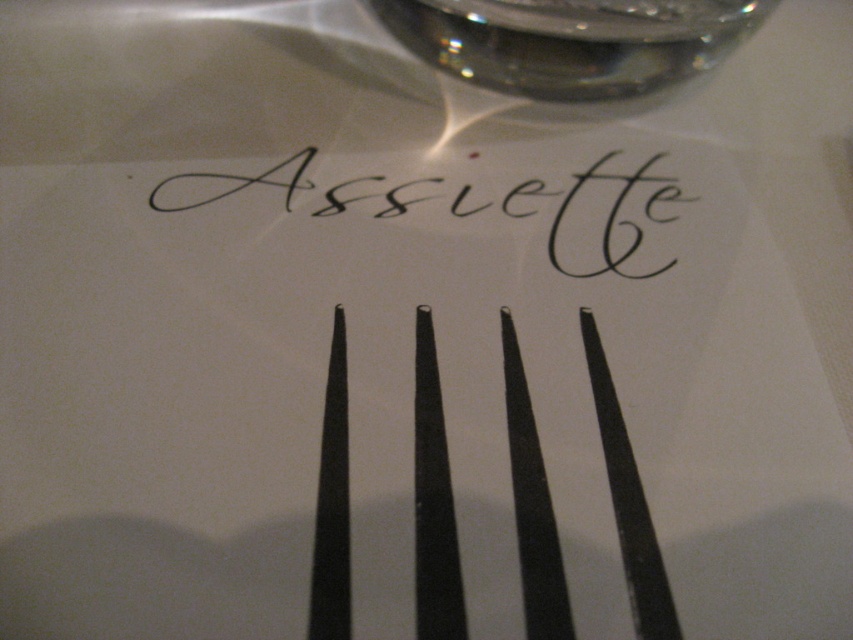
You are setting a table and need to place a black metal fork at center and a black calligraphy at center. According to the image, which one is positioned to the right side?

The black metal fork at center is to the right of the black calligraphy at center.

You are a server in a restaurant and need to place the black metal fork at center on the table without covering the black calligraphy at center. Can you position the fork so that it is at least 6 centimeters away from the calligraphy?

The distance between the black metal fork at center and the black calligraphy at center is 5.92 centimeters, which is just under 6 centimeters. Therefore, the fork would be too close to the calligraphy, and it might slightly cover part of the text if placed there.